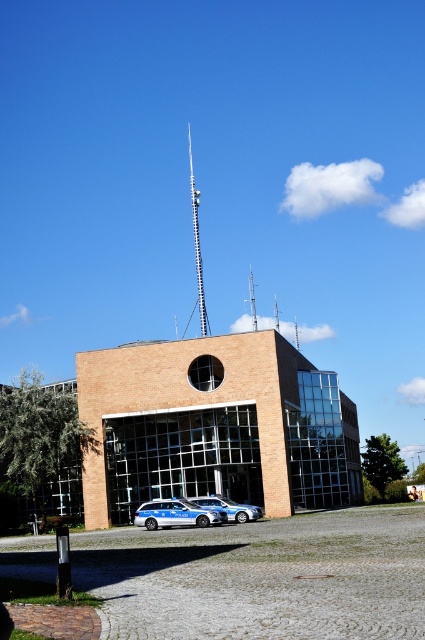
Question: Can you confirm if silver metallic tower at upper center is positioned to the right of metallic tower at center?

Choices:
 (A) yes
 (B) no

Answer: (B)

Question: Does blue metallic car at lower center appear over blue metallic car at center?

Choices:
 (A) yes
 (B) no

Answer: (B)

Question: Which point appears farthest from the camera in this image?

Choices:
 (A) (254, 328)
 (B) (249, 508)
 (C) (200, 512)

Answer: (A)

Question: From the image, what is the correct spatial relationship of blue metallic car at lower center in relation to metallic tower at center?

Choices:
 (A) below
 (B) above

Answer: (A)

Question: Among these points, which one is nearest to the camera?

Choices:
 (A) (181, 513)
 (B) (198, 269)
 (C) (241, 506)
 (D) (255, 321)

Answer: (A)

Question: Which is nearer to the blue metallic car at lower center?

Choices:
 (A) silver metallic tower at upper center
 (B) metallic tower at center
 (C) blue metallic car at center

Answer: (C)